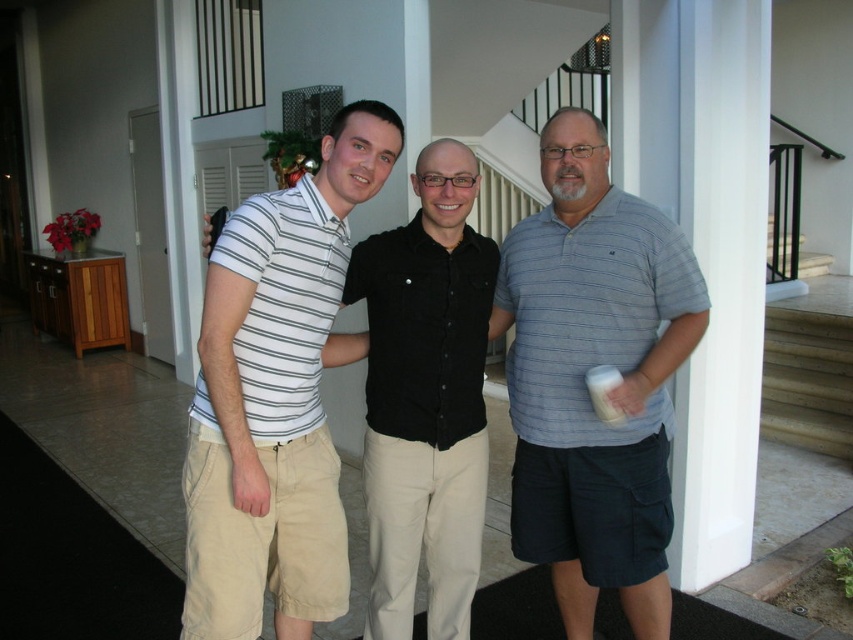
Looking at this image, does blue striped polo shirt at center have a lesser width compared to black cotton shirt at center?

Incorrect, blue striped polo shirt at center's width is not less than black cotton shirt at center's.

Does point (491, 323) come behind point (393, 333)?

Yes, point (491, 323) is farther from viewer.

Is point (593, 618) less distant than point (433, 593)?

No, (593, 618) is further to viewer.

This screenshot has height=640, width=853. In order to click on blue striped polo shirt at center in this screenshot , I will do `click(584, 380)`.

Does blue striped polo shirt at center lie behind white striped polo shirt at center?

Yes.

Is point (601, 362) closer to camera compared to point (306, 394)?

That is False.

You are a GUI agent. You are given a task and a screenshot of the screen. Output one action in this format:
    pyautogui.click(x=<x>, y=<y>)
    Task: Click on the blue striped polo shirt at center
    This screenshot has height=640, width=853.
    Given the screenshot: What is the action you would take?
    pyautogui.click(x=584, y=380)

Can you confirm if white striped polo shirt at center is positioned to the right of black cotton shirt at center?

No, white striped polo shirt at center is not to the right of black cotton shirt at center.

Is white striped polo shirt at center above black cotton shirt at center?

Yes.

Who is more forward, [323,227] or [354,280]?

Point [323,227]

Identify the location of white striped polo shirt at center. This screenshot has height=640, width=853. (276, 396).